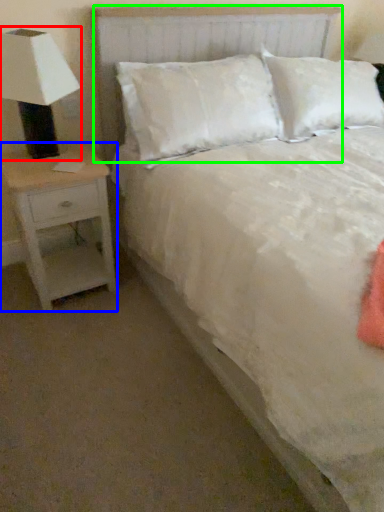
Question: Which object is the closest to the lamp (highlighted by a red box)? Choose among these: nightstand (highlighted by a blue box) or headboard (highlighted by a green box).

Choices:
 (A) nightstand
 (B) headboard

Answer: (A)